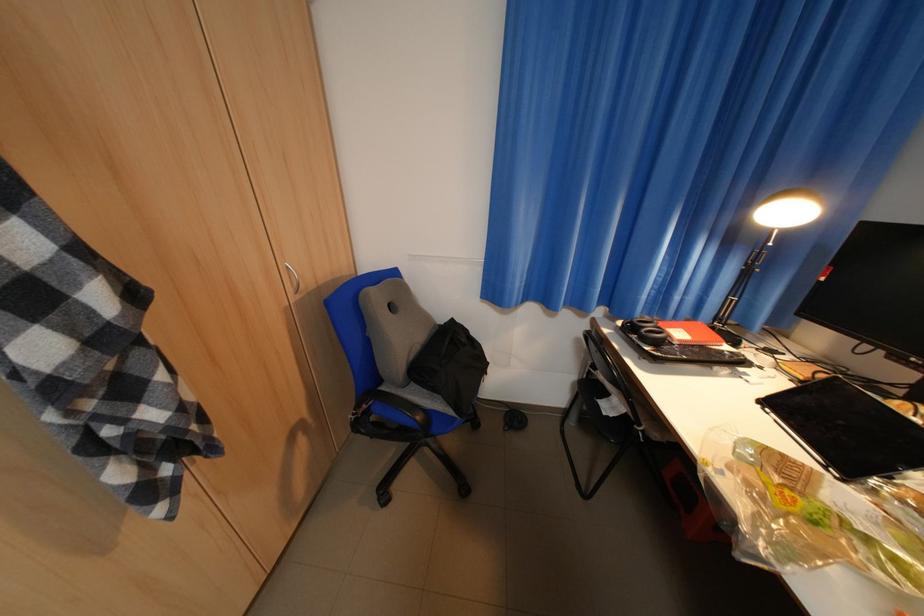
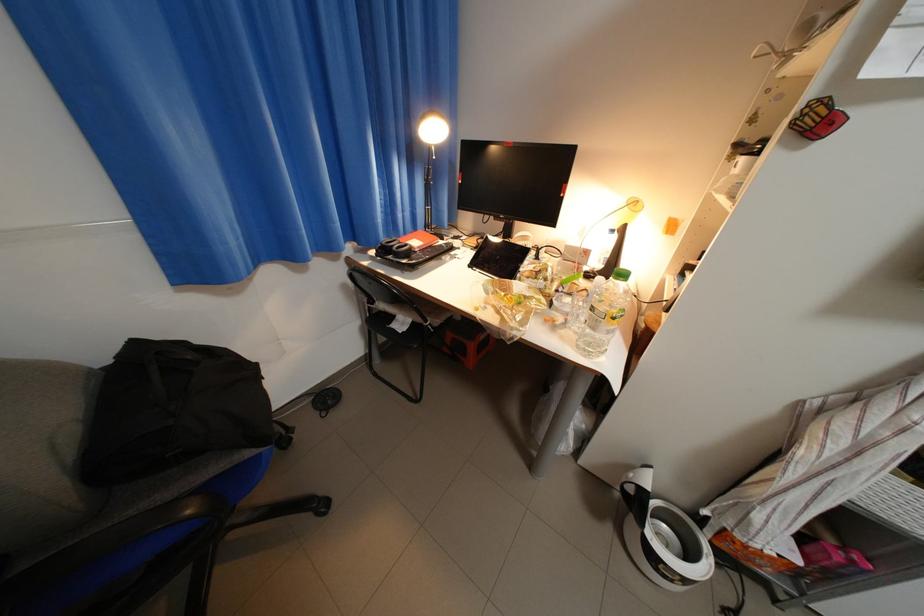
Where in the second image is the point corresponding to (x=465, y=321) from the first image?

(147, 344)